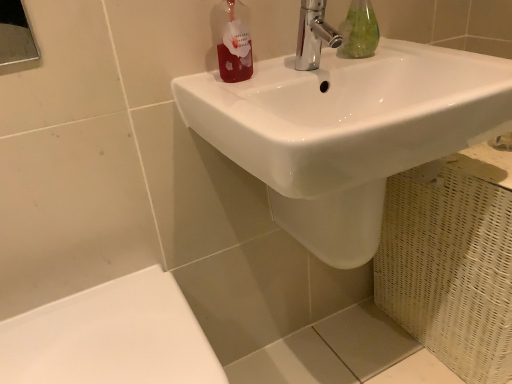
Where is `green glass bottle at upper center`? green glass bottle at upper center is located at coordinates (359, 31).

Find the location of `white glossy sink at upper center`. white glossy sink at upper center is located at coordinates [347, 132].

Measure the distance between point [126,375] and camera.

The distance of point [126,375] from camera is 65.20 centimeters.

The height and width of the screenshot is (384, 512). I want to click on chrome/metallic faucet at upper center, so click(313, 35).

Identify the location of translucent red bottle at upper center. This screenshot has height=384, width=512. (233, 41).

Is point (347, 28) closer to viewer compared to point (410, 63)?

That is False.

Consider the image. Is green glass bottle at upper center placed right next to white glossy sink at upper center?

No, green glass bottle at upper center is not with white glossy sink at upper center.

Which object is more forward, green glass bottle at upper center or white glossy sink at upper center?

Positioned in front is white glossy sink at upper center.

From a real-world perspective, is white glossy sink at upper center on top of translucent red bottle at upper center?

Actually, white glossy sink at upper center is physically below translucent red bottle at upper center in the real world.

Considering the relative positions of white glossy sink at upper center and translucent red bottle at upper center in the image provided, is white glossy sink at upper center to the right of translucent red bottle at upper center from the viewer's perspective?

Correct, you'll find white glossy sink at upper center to the right of translucent red bottle at upper center.

Is white glossy sink at upper center smaller than translucent red bottle at upper center?

No.

Can you confirm if white glossy sink at upper center is taller than translucent red bottle at upper center?

Yes.

Which object is positioned more to the right, translucent red bottle at upper center or chrome/metallic faucet at upper center?

From the viewer's perspective, chrome/metallic faucet at upper center appears more on the right side.

Based on the photo, which is more distant, (228, 59) or (307, 66)?

Point (307, 66)

Can chrome/metallic faucet at upper center be found inside translucent red bottle at upper center?

Actually, chrome/metallic faucet at upper center is outside translucent red bottle at upper center.

Can you see translucent red bottle at upper center touching chrome/metallic faucet at upper center?

No, translucent red bottle at upper center is not in contact with chrome/metallic faucet at upper center.

Which of these two, chrome/metallic faucet at upper center or white glossy sink at upper center, is thinner?

chrome/metallic faucet at upper center is thinner.

Consider the image. Is white glossy sink at upper center at the back of chrome/metallic faucet at upper center?

No, white glossy sink at upper center is not at the back of chrome/metallic faucet at upper center.

How many degrees apart are the facing directions of chrome/metallic faucet at upper center and white glossy sink at upper center?

The facing directions of chrome/metallic faucet at upper center and white glossy sink at upper center are 0.000579 degrees apart.

From the image's perspective, which is below, green glass bottle at upper center or white glossy porcelain at lower left?

white glossy porcelain at lower left.

Do you think green glass bottle at upper center is within white glossy porcelain at lower left, or outside of it?

green glass bottle at upper center is not inside white glossy porcelain at lower left, it's outside.

From a real-world perspective, is chrome/metallic faucet at upper center above or below white glossy porcelain at lower left?

Clearly, from a real-world perspective, chrome/metallic faucet at upper center is above white glossy porcelain at lower left.

Can you confirm if chrome/metallic faucet at upper center is thinner than white glossy porcelain at lower left?

Correct, the width of chrome/metallic faucet at upper center is less than that of white glossy porcelain at lower left.

Which object is more forward, chrome/metallic faucet at upper center or white glossy porcelain at lower left?

white glossy porcelain at lower left is closer to the camera.

Is chrome/metallic faucet at upper center spatially inside white glossy porcelain at lower left, or outside of it?

chrome/metallic faucet at upper center is not enclosed by white glossy porcelain at lower left.

Would you say translucent red bottle at upper center is a long distance from green glass bottle at upper center?

That's not correct — translucent red bottle at upper center is a little close to green glass bottle at upper center.

From the image's perspective, which is below, translucent red bottle at upper center or green glass bottle at upper center?

translucent red bottle at upper center appears lower in the image.

Is translucent red bottle at upper center turned away from green glass bottle at upper center?

translucent red bottle at upper center is not turned away from green glass bottle at upper center.

Is point (227, 67) closer to viewer compared to point (352, 55)?

Yes, point (227, 67) is closer to viewer.

This screenshot has height=384, width=512. Identify the location of mouthwash on the right of white glossy sink at upper center. (359, 31).

The width and height of the screenshot is (512, 384). In order to click on sink below the translucent red bottle at upper center (from a real-world perspective) in this screenshot , I will do `click(347, 132)`.

Based on their spatial positions, is white glossy porcelain at lower left or green glass bottle at upper center further from white glossy sink at upper center?

white glossy porcelain at lower left is positioned further to the anchor white glossy sink at upper center.

Estimate the real-world distances between objects in this image. Which object is closer to chrome/metallic faucet at upper center, white glossy porcelain at lower left or white glossy sink at upper center?

The object closer to chrome/metallic faucet at upper center is white glossy sink at upper center.

Based on their spatial positions, is translucent red bottle at upper center or green glass bottle at upper center further from chrome/metallic faucet at upper center?

translucent red bottle at upper center is further to chrome/metallic faucet at upper center.

Looking at the image, which one is located further to white glossy sink at upper center, green glass bottle at upper center or translucent red bottle at upper center?

The object further to white glossy sink at upper center is green glass bottle at upper center.

Based on their spatial positions, is white glossy sink at upper center or white glossy porcelain at lower left further from green glass bottle at upper center?

The object further to green glass bottle at upper center is white glossy porcelain at lower left.

Considering their positions, is white glossy sink at upper center positioned further to green glass bottle at upper center than chrome/metallic faucet at upper center?

white glossy sink at upper center.

Looking at the image, which one is located further to translucent red bottle at upper center, white glossy porcelain at lower left or white glossy sink at upper center?

Among the two, white glossy porcelain at lower left is located further to translucent red bottle at upper center.

Looking at the image, which one is located closer to chrome/metallic faucet at upper center, green glass bottle at upper center or white glossy sink at upper center?

green glass bottle at upper center is closer to chrome/metallic faucet at upper center.

You are a GUI agent. You are given a task and a screenshot of the screen. Output one action in this format:
    pyautogui.click(x=<x>, y=<y>)
    Task: Click on the sink between green glass bottle at upper center and white glossy porcelain at lower left in the up-down direction
    
    Given the screenshot: What is the action you would take?
    pyautogui.click(x=347, y=132)

The image size is (512, 384). What are the coordinates of `toiletry between green glass bottle at upper center and white glossy porcelain at lower left in the up-down direction` in the screenshot? It's located at (233, 41).

Identify the location of tap between green glass bottle at upper center and white glossy sink at upper center vertically. (313, 35).

You are a GUI agent. You are given a task and a screenshot of the screen. Output one action in this format:
    pyautogui.click(x=<x>, y=<y>)
    Task: Click on the tap between green glass bottle at upper center and white glossy porcelain at lower left vertically
    The image size is (512, 384).
    Given the screenshot: What is the action you would take?
    pyautogui.click(x=313, y=35)